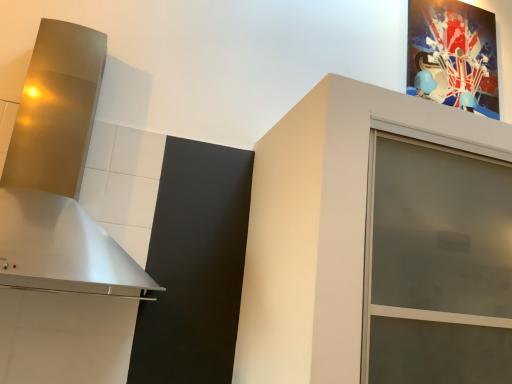
Question: Is metallic silver vent at left placed right next to metallic glossy picture frame at upper right?

Choices:
 (A) no
 (B) yes

Answer: (A)

Question: Does metallic silver vent at left have a lesser height compared to metallic glossy picture frame at upper right?

Choices:
 (A) no
 (B) yes

Answer: (A)

Question: Is metallic glossy picture frame at upper right at the back of metallic silver vent at left?

Choices:
 (A) no
 (B) yes

Answer: (A)

Question: Is metallic silver vent at left facing towards metallic glossy picture frame at upper right?

Choices:
 (A) yes
 (B) no

Answer: (B)

Question: Considering the relative positions of metallic silver vent at left and metallic glossy picture frame at upper right in the image provided, is metallic silver vent at left in front of metallic glossy picture frame at upper right?

Choices:
 (A) yes
 (B) no

Answer: (A)

Question: Does metallic silver vent at left contain metallic glossy picture frame at upper right?

Choices:
 (A) yes
 (B) no

Answer: (B)

Question: From the image's perspective, is frosted glass cabinet at upper right on metallic silver vent at left?

Choices:
 (A) no
 (B) yes

Answer: (A)

Question: Are frosted glass cabinet at upper right and metallic silver vent at left beside each other?

Choices:
 (A) yes
 (B) no

Answer: (B)

Question: Is frosted glass cabinet at upper right oriented away from metallic silver vent at left?

Choices:
 (A) no
 (B) yes

Answer: (A)

Question: Could you tell me if frosted glass cabinet at upper right is facing metallic silver vent at left?

Choices:
 (A) yes
 (B) no

Answer: (B)

Question: Is frosted glass cabinet at upper right to the left of metallic silver vent at left from the viewer's perspective?

Choices:
 (A) yes
 (B) no

Answer: (B)

Question: From a real-world perspective, is frosted glass cabinet at upper right positioned under metallic silver vent at left based on gravity?

Choices:
 (A) no
 (B) yes

Answer: (B)

Question: From the image's perspective, is metallic glossy picture frame at upper right below metallic silver vent at left?

Choices:
 (A) no
 (B) yes

Answer: (A)